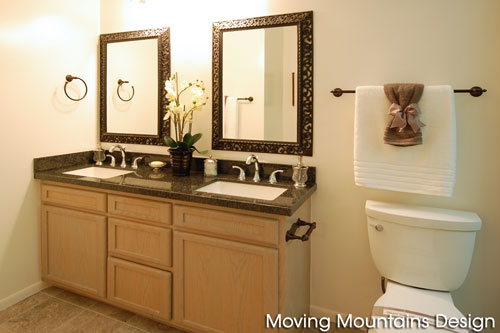
Image resolution: width=500 pixels, height=333 pixels. I want to click on toilet tissue holder, so click(308, 232).